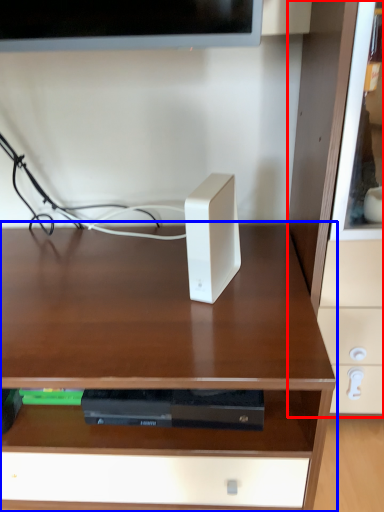
Question: Which point is further to the camera, dresser (highlighted by a red box) or desk (highlighted by a blue box)?

Choices:
 (A) dresser
 (B) desk

Answer: (B)